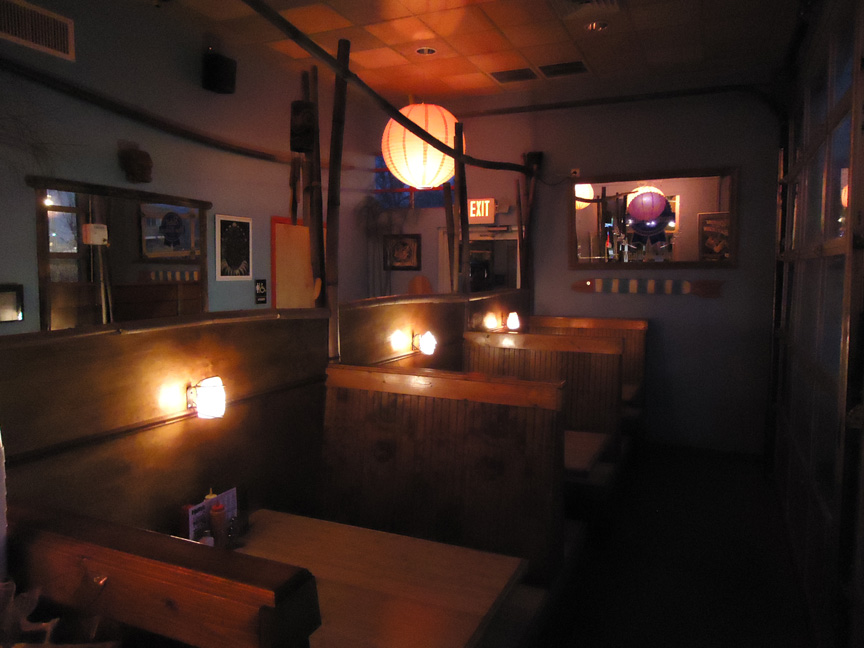
At what (x,y) coordinates should I click in order to perform the action: click on picture. Please return your answer as a coordinate pair (x, y). Image resolution: width=864 pixels, height=648 pixels. Looking at the image, I should click on (403, 253).